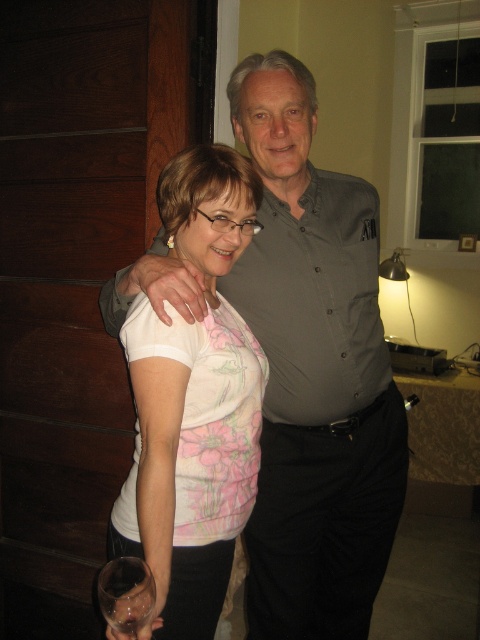
Question: Which of the following is the farthest from the observer?

Choices:
 (A) (133, 588)
 (B) (272, 520)
 (C) (226, 570)

Answer: (B)

Question: Which of these objects is positioned closest to the white floral shirt at center?

Choices:
 (A) transparent glass at lower left
 (B) gray button-up shirt at center

Answer: (B)

Question: Does gray button-up shirt at center appear on the right side of white floral shirt at center?

Choices:
 (A) no
 (B) yes

Answer: (B)

Question: In this image, where is white floral shirt at center located relative to transparent glass at lower left?

Choices:
 (A) above
 (B) below

Answer: (A)

Question: Can you confirm if gray button-up shirt at center is positioned to the right of transparent glass at lower left?

Choices:
 (A) no
 (B) yes

Answer: (B)

Question: Which point is closer to the camera?

Choices:
 (A) (231, 173)
 (B) (139, 614)
 (C) (369, 490)

Answer: (B)